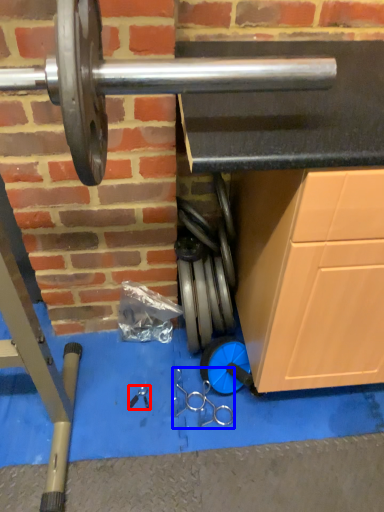
Question: Which object is closer to the camera taking this photo, tool (highlighted by a red box) or tool (highlighted by a blue box)?

Choices:
 (A) tool
 (B) tool

Answer: (B)